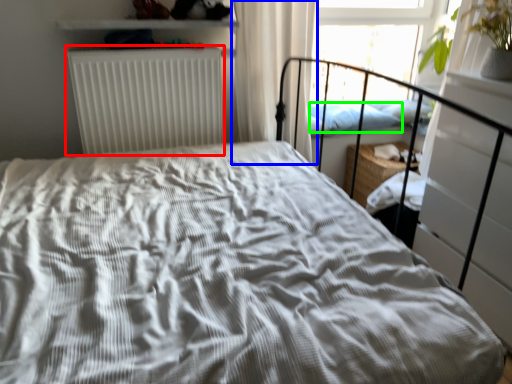
Question: Which is farther away from radiator (highlighted by a red box)? curtain (highlighted by a blue box) or pillow (highlighted by a green box)?

Choices:
 (A) curtain
 (B) pillow

Answer: (B)